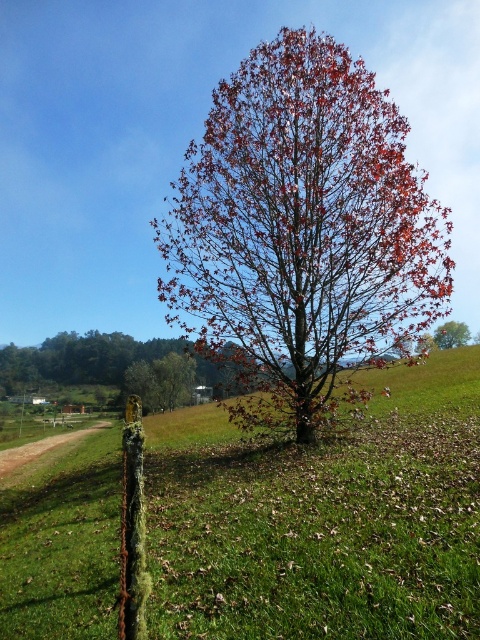
Question: Can you confirm if reddish-brown bark tree at center is positioned to the right of smooth brown tree at center?

Choices:
 (A) no
 (B) yes

Answer: (A)

Question: Does reddish-brown bark tree at center lie in front of smooth brown tree at center?

Choices:
 (A) yes
 (B) no

Answer: (A)

Question: Does reddish-brown bark tree at center appear under smooth brown tree at center?

Choices:
 (A) yes
 (B) no

Answer: (B)

Question: Which point appears closest to the camera in this image?

Choices:
 (A) (359, 157)
 (B) (465, 342)
 (C) (315, 637)

Answer: (C)

Question: Which object appears closest to the camera in this image?

Choices:
 (A) smooth brown tree at center
 (B) reddish-brown bark tree at center
 (C) green grassy at center

Answer: (C)

Question: Which of these objects is positioned farthest from the reddish-brown bark tree at center?

Choices:
 (A) green grassy at center
 (B) smooth brown tree at center

Answer: (B)